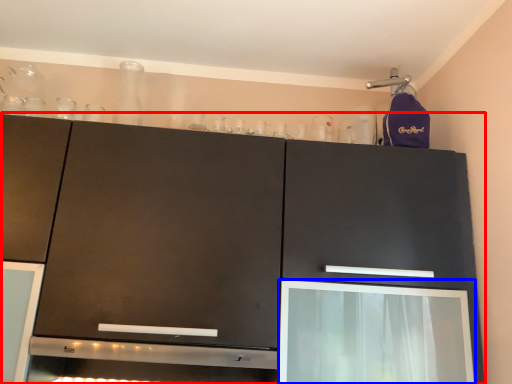
Question: Which point is closer to the camera, cabinetry (highlighted by a red box) or screen door (highlighted by a blue box)?

Choices:
 (A) cabinetry
 (B) screen door

Answer: (A)